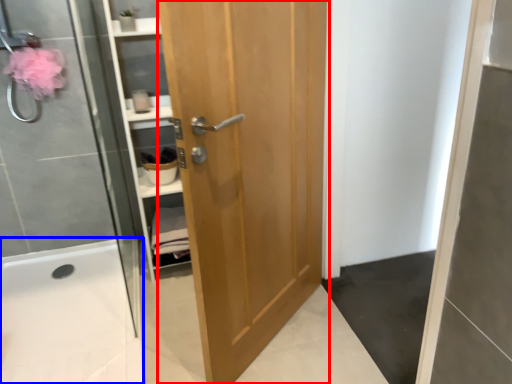
Question: Which object is further to the camera taking this photo, door (highlighted by a red box) or bath (highlighted by a blue box)?

Choices:
 (A) door
 (B) bath

Answer: (B)